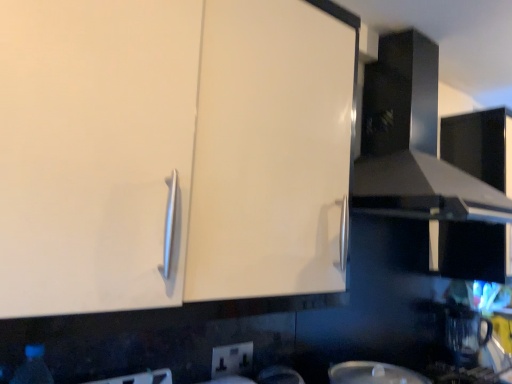
Describe the element at coordinates (466, 333) in the screenshot. I see `transparent plastic coffee machine at lower right` at that location.

What are the coordinates of `white glossy cabinet at upper left` in the screenshot? It's located at (170, 151).

The image size is (512, 384). What do you see at coordinates (231, 359) in the screenshot?
I see `white plastic electric outlet at lower center` at bounding box center [231, 359].

What do you see at coordinates (412, 142) in the screenshot?
I see `glossy black exhaust hood at upper right` at bounding box center [412, 142].

Locate an element on the screen. The height and width of the screenshot is (384, 512). glossy black exhaust hood at upper right is located at coordinates (412, 142).

This screenshot has height=384, width=512. Describe the element at coordinates (33, 367) in the screenshot. I see `transparent plastic bottle at lower left` at that location.

Identify the location of transparent plastic coffee machine at lower right. The height and width of the screenshot is (384, 512). (466, 333).

From a real-world perspective, between white glossy cabinet at upper left and white glossy plate at lower center, who is vertically lower?

white glossy plate at lower center, from a real-world perspective.

Considering the relative sizes of white glossy cabinet at upper left and white glossy plate at lower center in the image provided, is white glossy cabinet at upper left wider than white glossy plate at lower center?

Indeed, white glossy cabinet at upper left has a greater width compared to white glossy plate at lower center.

Based on the photo, is white glossy cabinet at upper left facing away from white glossy plate at lower center?

No, white glossy cabinet at upper left's orientation is not away from white glossy plate at lower center.

Do you think white glossy cabinet at upper left is within white glossy plate at lower center, or outside of it?

white glossy cabinet at upper left is not inside white glossy plate at lower center, it's outside.

Which of these two, white glossy cabinet at upper left or transparent plastic coffee machine at lower right, is wider?

Wider between the two is white glossy cabinet at upper left.

Is the surface of white glossy cabinet at upper left in direct contact with transparent plastic coffee machine at lower right?

No, white glossy cabinet at upper left is not with transparent plastic coffee machine at lower right.

Is white glossy cabinet at upper left facing away from transparent plastic coffee machine at lower right?

No, white glossy cabinet at upper left is not facing the opposite direction of transparent plastic coffee machine at lower right.

In the scene shown: From a real-world perspective, is glossy black exhaust hood at upper right beneath white glossy plate at lower center?

No, from a real-world perspective, glossy black exhaust hood at upper right is not beneath white glossy plate at lower center.

Is glossy black exhaust hood at upper right positioned far away from white glossy plate at lower center?

No.

Can you confirm if glossy black exhaust hood at upper right is wider than white glossy plate at lower center?

Yes, glossy black exhaust hood at upper right is wider than white glossy plate at lower center.

Is transparent plastic bottle at lower left inside or outside of glossy black exhaust hood at upper right?

transparent plastic bottle at lower left is spatially situated outside glossy black exhaust hood at upper right.

Are transparent plastic bottle at lower left and glossy black exhaust hood at upper right located far from each other?

transparent plastic bottle at lower left is far away from glossy black exhaust hood at upper right.

From the image's perspective, between transparent plastic bottle at lower left and glossy black exhaust hood at upper right, which one is located above?

From the image's view, glossy black exhaust hood at upper right is above.

Is transparent plastic bottle at lower left smaller than glossy black exhaust hood at upper right?

Yes.

In the image, is transparent plastic bottle at lower left positioned in front of or behind transparent plastic coffee machine at lower right?

Clearly, transparent plastic bottle at lower left is in front of transparent plastic coffee machine at lower right.

Is transparent plastic bottle at lower left inside or outside of transparent plastic coffee machine at lower right?

transparent plastic bottle at lower left is located beyond the bounds of transparent plastic coffee machine at lower right.

Can you tell me how much transparent plastic bottle at lower left and transparent plastic coffee machine at lower right differ in facing direction?

5.3 degrees.

Does transparent plastic bottle at lower left touch transparent plastic coffee machine at lower right?

transparent plastic bottle at lower left and transparent plastic coffee machine at lower right are clearly separated.

Considering the positions of points (15, 373) and (233, 365), is point (15, 373) farther from camera compared to point (233, 365)?

That is False.

Consider the image. From a real-world perspective, is transparent plastic bottle at lower left physically located above or below white plastic electric outlet at lower center?

Clearly, from a real-world perspective, transparent plastic bottle at lower left is below white plastic electric outlet at lower center.

Is transparent plastic bottle at lower left situated inside white plastic electric outlet at lower center or outside?

transparent plastic bottle at lower left exists outside the volume of white plastic electric outlet at lower center.

Considering the relative sizes of transparent plastic bottle at lower left and white plastic electric outlet at lower center in the image provided, is transparent plastic bottle at lower left bigger than white plastic electric outlet at lower center?

Yes, transparent plastic bottle at lower left is bigger than white plastic electric outlet at lower center.

Which of these two, glossy black exhaust hood at upper right or white glossy cabinet at upper left, is bigger?

Bigger between the two is glossy black exhaust hood at upper right.

In the scene shown: From the image's perspective, is glossy black exhaust hood at upper right located above or below white glossy cabinet at upper left?

glossy black exhaust hood at upper right is situated higher than white glossy cabinet at upper left in the image.

Between glossy black exhaust hood at upper right and white glossy cabinet at upper left, which one has less height?

glossy black exhaust hood at upper right is shorter.

Can you confirm if glossy black exhaust hood at upper right is thinner than white glossy cabinet at upper left?

Incorrect, the width of glossy black exhaust hood at upper right is not less than that of white glossy cabinet at upper left.

At what (x,y) coordinates should I click in order to perform the action: click on cabinetry above the white glossy plate at lower center (from the image's perspective). Please return your answer as a coordinate pair (x, y). Image resolution: width=512 pixels, height=384 pixels. Looking at the image, I should click on (170, 151).

I want to click on cabinetry in front of the transparent plastic coffee machine at lower right, so click(x=170, y=151).

When comparing their distances from white glossy cabinet at upper left, does glossy black exhaust hood at upper right or white plastic electric outlet at lower center seem further?

white plastic electric outlet at lower center.

In the scene shown: Which object lies nearer to the anchor point glossy black exhaust hood at upper right, transparent plastic bottle at lower left or white plastic electric outlet at lower center?

Among the two, white plastic electric outlet at lower center is located nearer to glossy black exhaust hood at upper right.

Considering their positions, is glossy black exhaust hood at upper right positioned further to white plastic electric outlet at lower center than white glossy plate at lower center?

Among the two, glossy black exhaust hood at upper right is located further to white plastic electric outlet at lower center.

Looking at the image, which one is located further to transparent plastic coffee machine at lower right, white plastic electric outlet at lower center or white glossy plate at lower center?

white plastic electric outlet at lower center lies further to transparent plastic coffee machine at lower right than the other object.

Based on their spatial positions, is transparent plastic bottle at lower left or white glossy cabinet at upper left closer to glossy black exhaust hood at upper right?

Based on the image, white glossy cabinet at upper left appears to be nearer to glossy black exhaust hood at upper right.

Looking at the image, which one is located further to transparent plastic coffee machine at lower right, glossy black exhaust hood at upper right or white glossy plate at lower center?

glossy black exhaust hood at upper right lies further to transparent plastic coffee machine at lower right than the other object.

Estimate the real-world distances between objects in this image. Which object is further from glossy black exhaust hood at upper right, white glossy cabinet at upper left or transparent plastic coffee machine at lower right?

transparent plastic coffee machine at lower right is positioned further to the anchor glossy black exhaust hood at upper right.

From the image, which object appears to be nearer to white glossy plate at lower center, white glossy cabinet at upper left or transparent plastic coffee machine at lower right?

Among the two, white glossy cabinet at upper left is located nearer to white glossy plate at lower center.

Where is `appliance between glossy black exhaust hood at upper right and transparent plastic coffee machine at lower right in the vertical direction`? This screenshot has width=512, height=384. appliance between glossy black exhaust hood at upper right and transparent plastic coffee machine at lower right in the vertical direction is located at coordinates (373, 374).

Where is `electric outlet between white glossy cabinet at upper left and glossy black exhaust hood at upper right in the horizontal direction`? The width and height of the screenshot is (512, 384). electric outlet between white glossy cabinet at upper left and glossy black exhaust hood at upper right in the horizontal direction is located at coordinates (231, 359).

Find the location of a particular element. electric outlet between transparent plastic bottle at lower left and white glossy plate at lower center from left to right is located at coordinates (231, 359).

Where is `electric outlet located between transparent plastic bottle at lower left and glossy black exhaust hood at upper right in the left-right direction`? The image size is (512, 384). electric outlet located between transparent plastic bottle at lower left and glossy black exhaust hood at upper right in the left-right direction is located at coordinates click(231, 359).